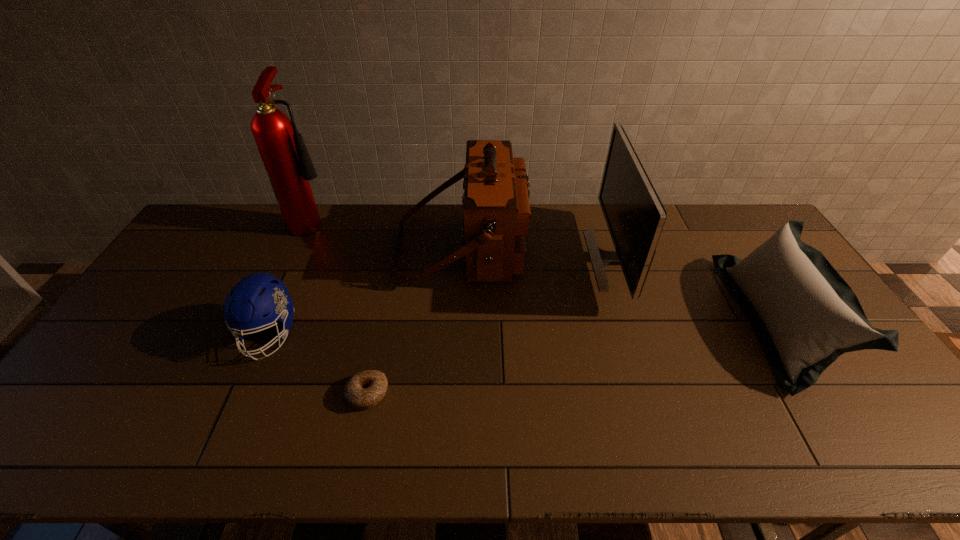
The width and height of the screenshot is (960, 540). What are the coordinates of `fire extinguisher` in the screenshot? It's located at (289, 167).

Find the location of `the second object from right to left`. the second object from right to left is located at coordinates (635, 216).

You are a GUI agent. You are given a task and a screenshot of the screen. Output one action in this format:
    pyautogui.click(x=<x>, y=<y>)
    Task: Click on the satchel
    This screenshot has width=960, height=540.
    Given the screenshot: What is the action you would take?
    pyautogui.click(x=496, y=209)

I want to click on cushion, so [x=803, y=313].

Identify the location of football helmet. (258, 294).

The height and width of the screenshot is (540, 960). I want to click on doughnut, so click(x=365, y=389).

Locate an element on the screen. This screenshot has width=960, height=540. vacant space located 0.070m at the nozzle of the tallest object is located at coordinates (355, 220).

This screenshot has height=540, width=960. Find the location of `vacant space located 0.050m on the screen side of the monitor`. vacant space located 0.050m on the screen side of the monitor is located at coordinates [576, 260].

Where is `free space located on the screen side of the monitor`? Image resolution: width=960 pixels, height=540 pixels. free space located on the screen side of the monitor is located at coordinates (489, 260).

Find the location of a particular element. The width and height of the screenshot is (960, 540). free space located on the screen side of the monitor is located at coordinates pyautogui.click(x=570, y=260).